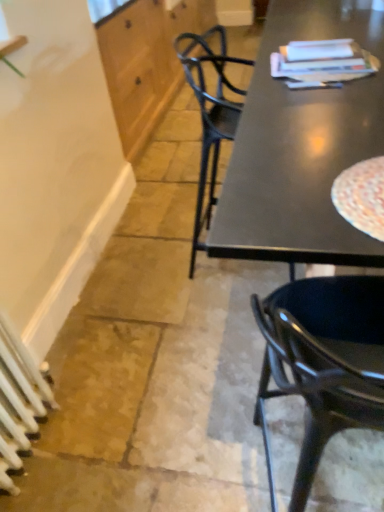
Question: From the image's perspective, is white metallic radiator at lower left on white wood cabinet at upper left?

Choices:
 (A) yes
 (B) no

Answer: (B)

Question: Can you confirm if white metallic radiator at lower left is wider than white wood cabinet at upper left?

Choices:
 (A) yes
 (B) no

Answer: (B)

Question: Are white metallic radiator at lower left and white wood cabinet at upper left far apart?

Choices:
 (A) yes
 (B) no

Answer: (A)

Question: Does white metallic radiator at lower left appear on the left side of white wood cabinet at upper left?

Choices:
 (A) no
 (B) yes

Answer: (B)

Question: Is white metallic radiator at lower left behind white wood cabinet at upper left?

Choices:
 (A) yes
 (B) no

Answer: (B)

Question: From their relative heights in the image, would you say glossy black chair at right is taller or shorter than white metallic radiator at lower left?

Choices:
 (A) tall
 (B) short

Answer: (A)

Question: From a real-world perspective, is glossy black chair at right physically located above or below white metallic radiator at lower left?

Choices:
 (A) below
 (B) above

Answer: (B)

Question: Does point (292, 322) appear closer or farther from the camera than point (8, 448)?

Choices:
 (A) farther
 (B) closer

Answer: (B)

Question: From the image's perspective, is glossy black chair at right located above or below white metallic radiator at lower left?

Choices:
 (A) below
 (B) above

Answer: (B)

Question: From the image's perspective, is white metallic radiator at lower left positioned above or below glossy black chair at right?

Choices:
 (A) above
 (B) below

Answer: (B)

Question: Visually, is white metallic radiator at lower left positioned to the left or to the right of glossy black chair at right?

Choices:
 (A) left
 (B) right

Answer: (A)

Question: From their relative heights in the image, would you say white metallic radiator at lower left is taller or shorter than glossy black chair at right?

Choices:
 (A) short
 (B) tall

Answer: (A)

Question: In the image, is white metallic radiator at lower left positioned in front of or behind glossy black chair at right?

Choices:
 (A) behind
 (B) front

Answer: (A)

Question: Considering the relative positions of white wood cabinet at upper left and glossy black chair at right in the image provided, is white wood cabinet at upper left to the left or to the right of glossy black chair at right?

Choices:
 (A) right
 (B) left

Answer: (B)

Question: Considering the positions of white wood cabinet at upper left and glossy black chair at right in the image, is white wood cabinet at upper left taller or shorter than glossy black chair at right?

Choices:
 (A) short
 (B) tall

Answer: (A)